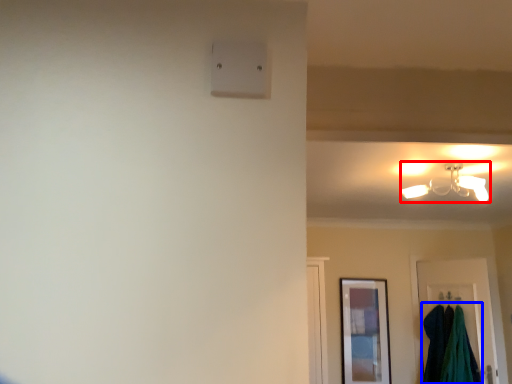
Question: Which object appears farthest to the camera in this image, lamp (highlighted by a red box) or laundry (highlighted by a blue box)?

Choices:
 (A) lamp
 (B) laundry

Answer: (B)